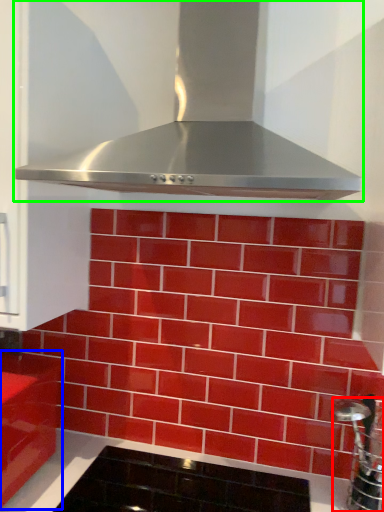
Question: Which is nearer to the stainless steel (highlighted by a red box)? cabinetry (highlighted by a blue box) or home appliance (highlighted by a green box).

Choices:
 (A) cabinetry
 (B) home appliance

Answer: (B)